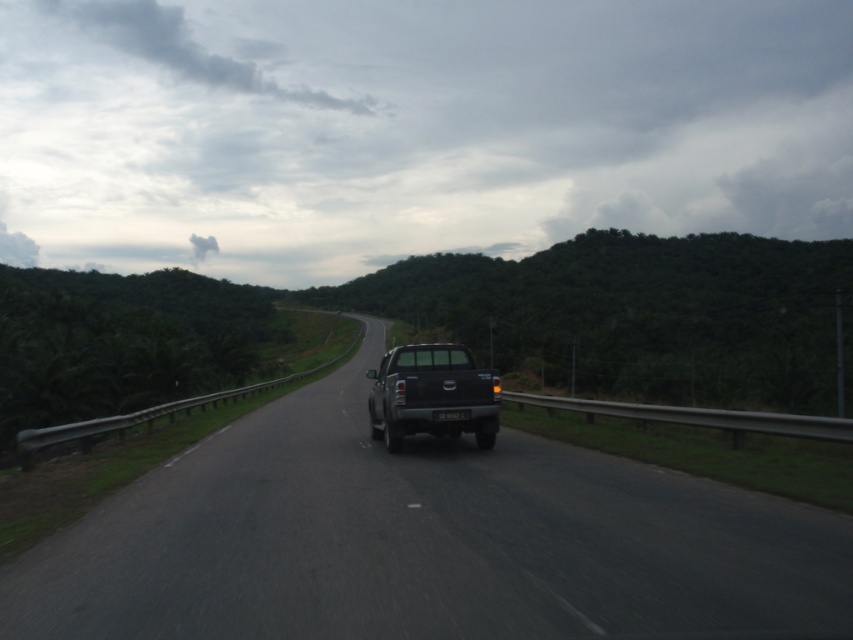
Question: Among these points, which one is nearest to the camera?

Choices:
 (A) (741, 547)
 (B) (483, 378)

Answer: (A)

Question: Does black matte truck at center appear on the right side of matte black truck at center?

Choices:
 (A) no
 (B) yes

Answer: (B)

Question: Is black matte truck at center further to camera compared to matte black truck at center?

Choices:
 (A) no
 (B) yes

Answer: (A)

Question: Which of the following is the closest to the observer?

Choices:
 (A) black matte truck at center
 (B) matte black truck at center

Answer: (A)

Question: Which point is farther to the camera?

Choices:
 (A) (456, 376)
 (B) (688, 513)

Answer: (A)

Question: Is black matte truck at center above matte black truck at center?

Choices:
 (A) yes
 (B) no

Answer: (A)